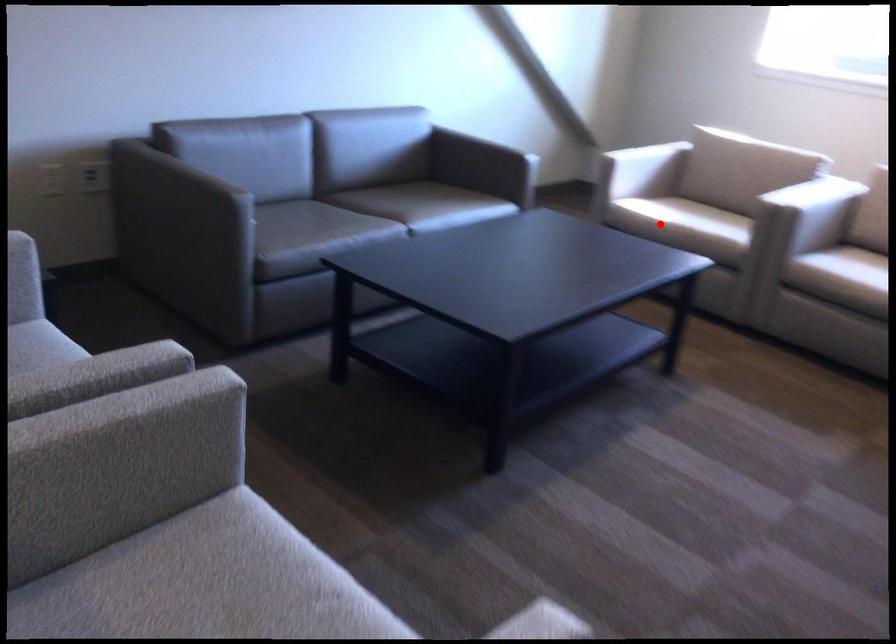
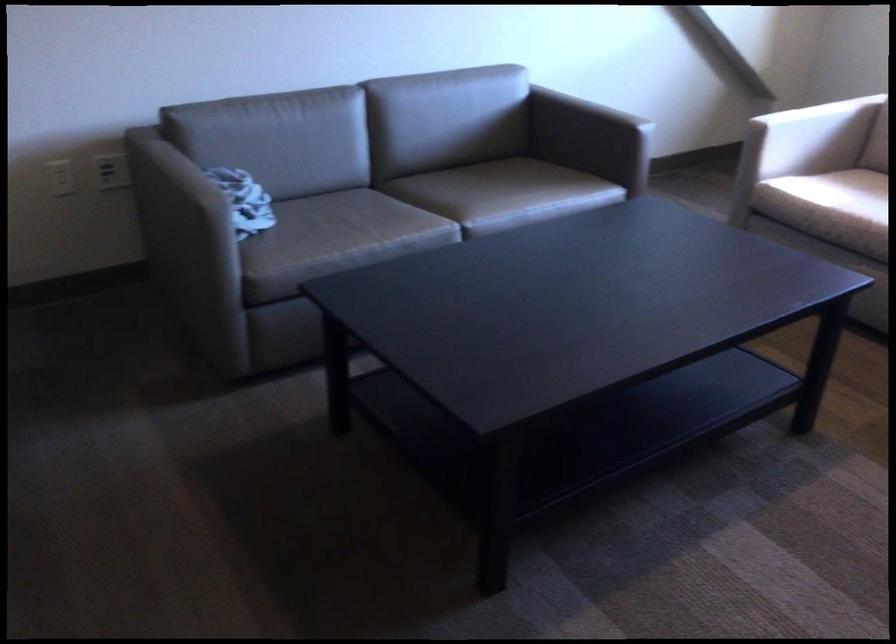
Question: I am providing you with two images of the same scene from different viewpoints. A red point is shown in image1. For the corresponding object point in image2, is it positioned nearer or farther from the camera?

Choices:
 (A) Nearer
 (B) Farther

Answer: (A)